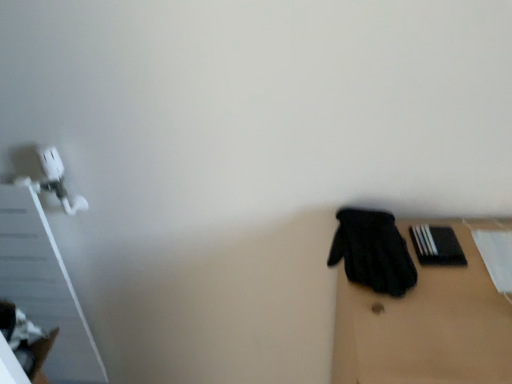
The width and height of the screenshot is (512, 384). Find the location of `free space in front of black matte book at right`. free space in front of black matte book at right is located at coordinates (450, 299).